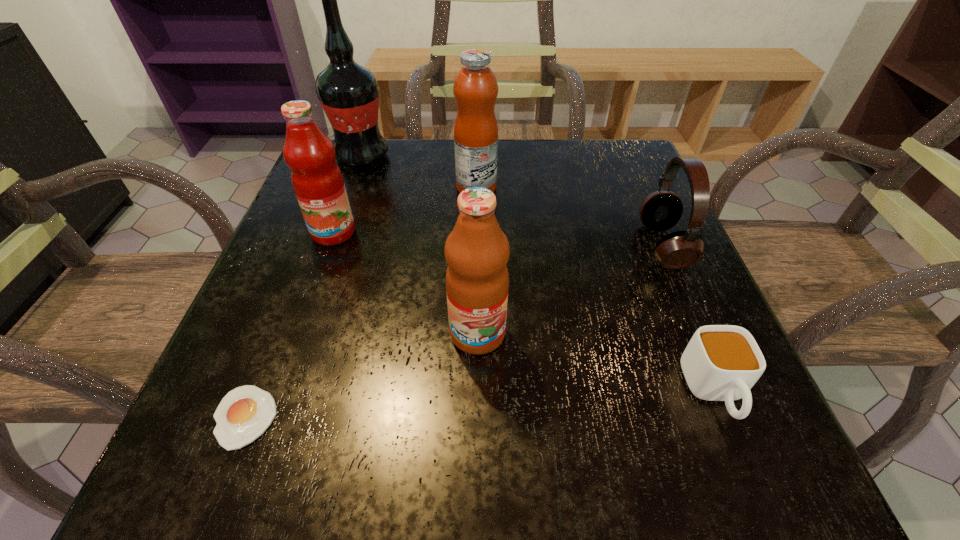
Where is `egg yolk at the near edge`? The image size is (960, 540). egg yolk at the near edge is located at coordinates coord(244,413).

The width and height of the screenshot is (960, 540). Find the location of `wine bottle located at the left edge`. wine bottle located at the left edge is located at coordinates (348, 92).

Where is `fruit juice that is at the left edge`? fruit juice that is at the left edge is located at coordinates (x=317, y=180).

Locate an element on the screen. egg yolk that is positioned at the left edge is located at coordinates (244, 413).

Locate an element on the screen. Image resolution: width=960 pixels, height=540 pixels. headset present at the right edge is located at coordinates (661, 210).

I want to click on cup at the right edge, so click(x=721, y=362).

Where is `object located at the far left corner`? object located at the far left corner is located at coordinates (348, 92).

Find the location of `object present at the near left corner`. object present at the near left corner is located at coordinates (244, 413).

The image size is (960, 540). I want to click on object located in the near right corner section of the desktop, so click(x=721, y=362).

Where is `vacant space at the far edge of the desktop`? Image resolution: width=960 pixels, height=540 pixels. vacant space at the far edge of the desktop is located at coordinates (422, 148).